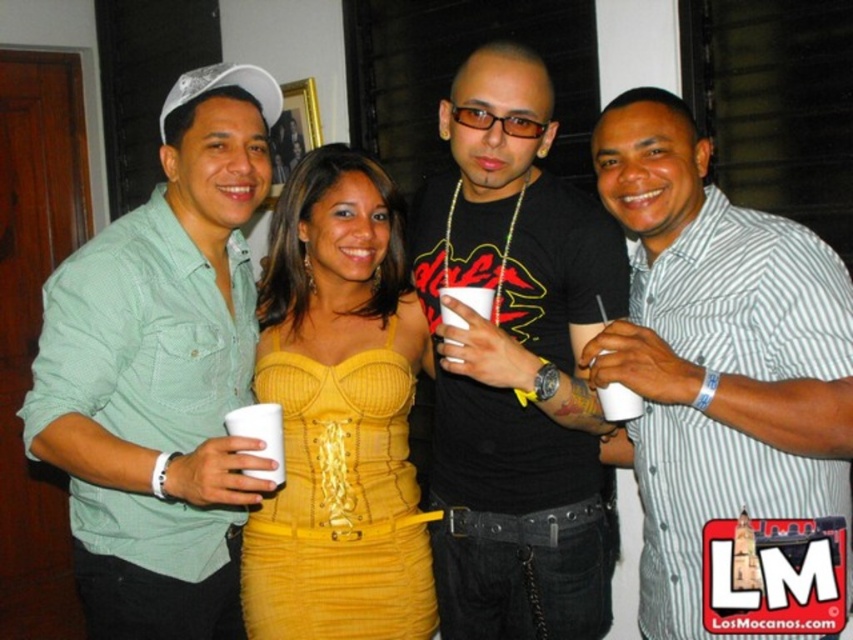
What is located at the coordinates point (717, 356)?

The white striped shirt at center is located at point (717, 356).

You are at a party and see the green cotton shirt at left and the white plastic cup at center. Which object is taller?

The green cotton shirt at left is much taller than the white plastic cup at center.

You are at a party and see the white striped shirt at center and the white plastic cup at center. Which one is wider?

The white striped shirt at center is wider than the white plastic cup at center.